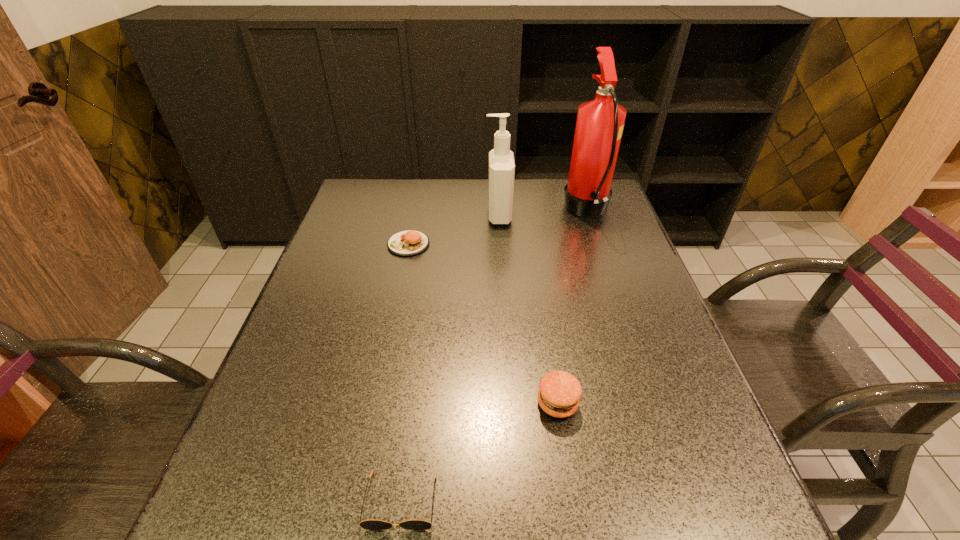
At what (x,y) coordinates should I click in order to perform the action: click on free space between the second tallest object and the right patty. Please return your answer as a coordinate pair (x, y). This screenshot has height=540, width=960. Looking at the image, I should click on (528, 309).

I want to click on vacant space in between the left patty and the fire extinguisher, so click(498, 227).

Where is `free space between the third object from left to right and the third shortest object`? The width and height of the screenshot is (960, 540). free space between the third object from left to right and the third shortest object is located at coordinates (528, 309).

Identify the location of vacant region between the taller patty and the shorter patty. This screenshot has width=960, height=540. (483, 324).

Image resolution: width=960 pixels, height=540 pixels. Find the location of `vacant space that's between the rightmost object and the left patty`. vacant space that's between the rightmost object and the left patty is located at coordinates tap(498, 227).

Find the location of a particular element. The height and width of the screenshot is (540, 960). free area in between the third tallest object and the left patty is located at coordinates coord(483,324).

The width and height of the screenshot is (960, 540). I want to click on unoccupied area between the fire extinguisher and the fourth farthest object, so click(x=572, y=307).

Identify the location of free spot between the third object from right to left and the farther patty. Image resolution: width=960 pixels, height=540 pixels. (453, 230).

I want to click on vacant area between the sunglasses and the rightmost object, so click(x=494, y=356).

Where is `object identified as the fourth closest to the nearest object`? This screenshot has height=540, width=960. object identified as the fourth closest to the nearest object is located at coordinates (600, 122).